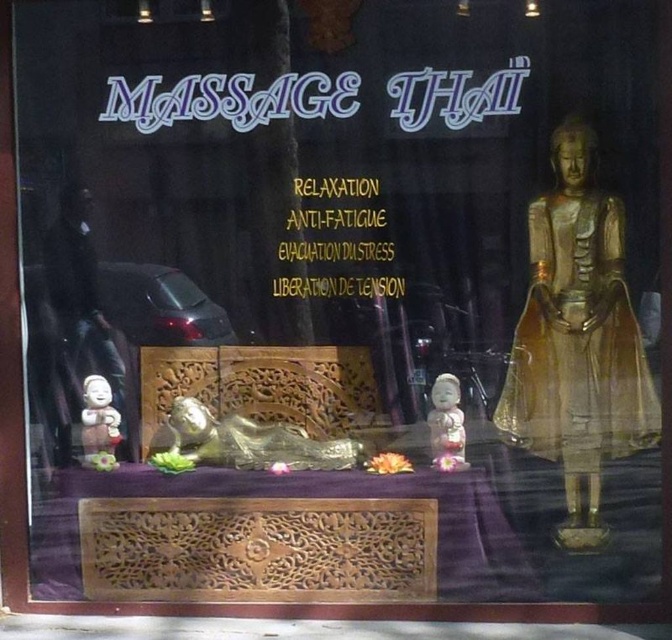
Question: Can you confirm if gold metallic statue at center is bigger than white porcelain figurine at center?

Choices:
 (A) no
 (B) yes

Answer: (B)

Question: Which object is the farthest from the gold metallic statue at center?

Choices:
 (A) white porcelain figurine at lower left
 (B) gold polished statue at right
 (C) white porcelain figurine at center

Answer: (B)

Question: Can you confirm if white porcelain figurine at center is thinner than white porcelain figurine at lower left?

Choices:
 (A) no
 (B) yes

Answer: (B)

Question: Which point appears farthest from the camera in this image?

Choices:
 (A) (458, 467)
 (B) (569, 493)

Answer: (B)

Question: Estimate the real-world distances between objects in this image. Which object is farther from the white porcelain figurine at lower left?

Choices:
 (A) gold polished statue at right
 (B) white porcelain figurine at center

Answer: (A)

Question: Can you confirm if gold metallic statue at center is positioned below white porcelain figurine at lower left?

Choices:
 (A) no
 (B) yes

Answer: (B)